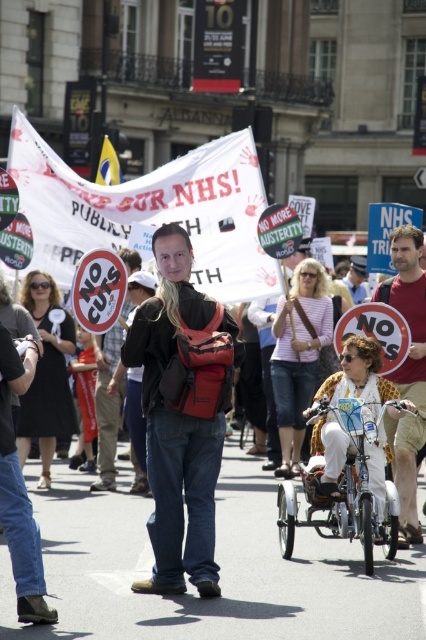
Question: Which object is the closest to the white plastic tricycle at center?

Choices:
 (A) matte black sign at center
 (B) matte red sign at center

Answer: (B)

Question: Does matte red sign at center appear on the left side of matte black sign at center?

Choices:
 (A) no
 (B) yes

Answer: (B)

Question: Is white plastic tricycle at center thinner than matte red sign at center?

Choices:
 (A) yes
 (B) no

Answer: (A)

Question: Which object is farther from the camera taking this photo?

Choices:
 (A) matte black sign at center
 (B) matte red sign at center
 (C) white plastic tricycle at center

Answer: (A)

Question: Which object appears farthest from the camera in this image?

Choices:
 (A) matte black sign at center
 (B) matte red sign at center
 (C) white plastic tricycle at center

Answer: (A)

Question: Is matte red sign at center closer to the viewer compared to matte black sign at center?

Choices:
 (A) yes
 (B) no

Answer: (A)